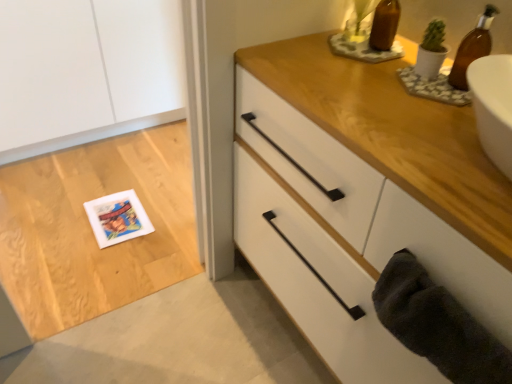
Locate an element on the screen. The height and width of the screenshot is (384, 512). free space above white matte chest of drawers at upper right (from a real-world perspective) is located at coordinates (388, 90).